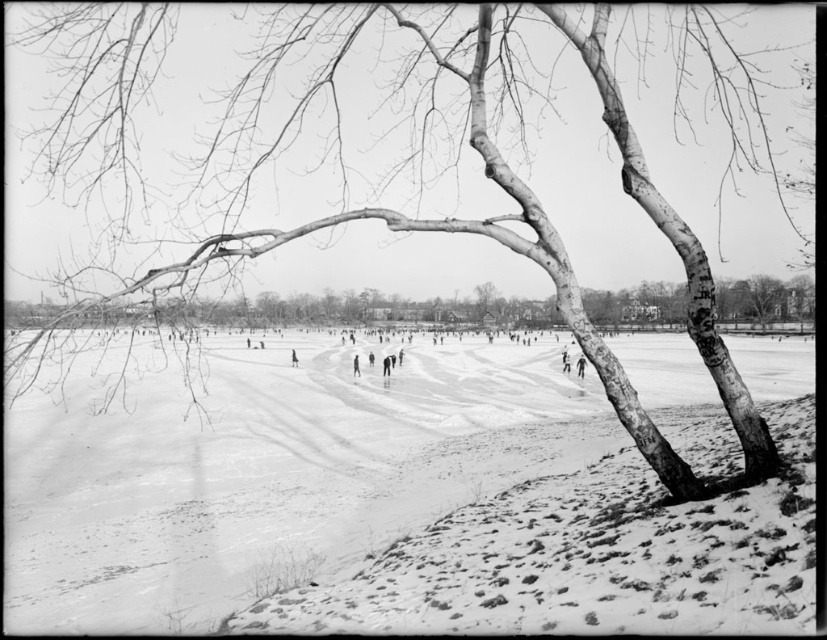
Question: Which object appears closest to the camera in this image?

Choices:
 (A) white powdery snow at center
 (B) smooth bark tree at center
 (C) smooth skin person at center

Answer: (B)

Question: Does white powdery snow at center appear under smooth skin person at center?

Choices:
 (A) yes
 (B) no

Answer: (B)

Question: Which is nearer to the smooth bark tree at center?

Choices:
 (A) white powdery snow at center
 (B) smooth skin person at center

Answer: (A)

Question: Among these points, which one is nearest to the camera?

Choices:
 (A) (306, 296)
 (B) (88, 552)

Answer: (B)

Question: Is white powdery snow at center positioned at the back of smooth bark tree at center?

Choices:
 (A) yes
 (B) no

Answer: (A)

Question: Is white powdery snow at center positioned in front of smooth skin person at center?

Choices:
 (A) no
 (B) yes

Answer: (B)